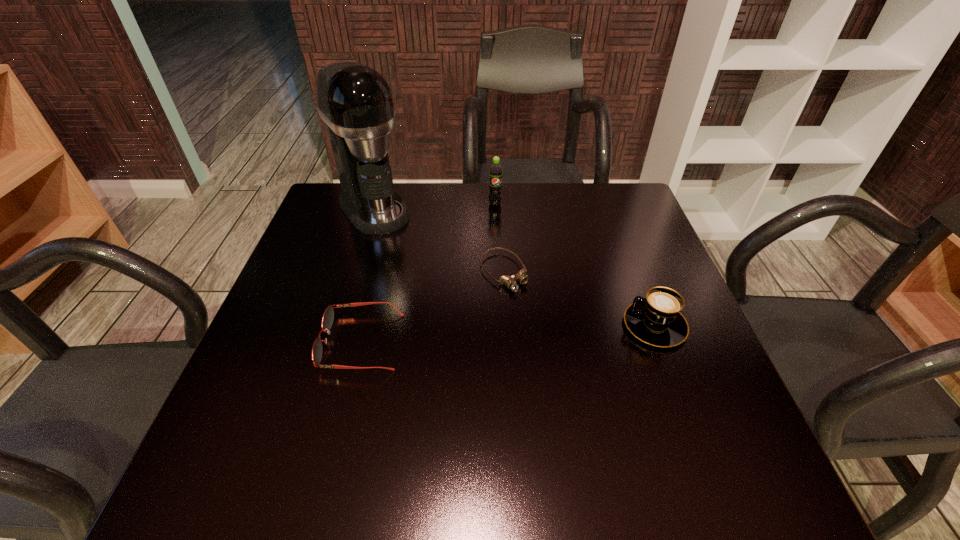
This screenshot has height=540, width=960. I want to click on vacant point located between the second tallest object and the third farthest object, so click(499, 238).

I want to click on empty space that is in between the goggles and the rightmost object, so 579,299.

Where is `object that stands as the closest to the third tallest object`? This screenshot has width=960, height=540. object that stands as the closest to the third tallest object is located at coordinates (509, 281).

Select which object appears as the fourth closest to the soda. Please provide its 2D coordinates. Your answer should be formatted as a tuple, i.e. [(x, y)], where the tuple contains the x and y coordinates of a point satisfying the conditions above.

[(656, 320)]

What are the coordinates of `blank area in the image that satisfies the following two spatial constraints: 1. on the front side of the coffee maker; 2. on the left side of the third tallest object` in the screenshot? It's located at (339, 325).

Where is `free space that satisfies the following two spatial constraints: 1. on the front side of the rightmost object; 2. on the right side of the coffee maker`? This screenshot has width=960, height=540. free space that satisfies the following two spatial constraints: 1. on the front side of the rightmost object; 2. on the right side of the coffee maker is located at coordinates (339, 325).